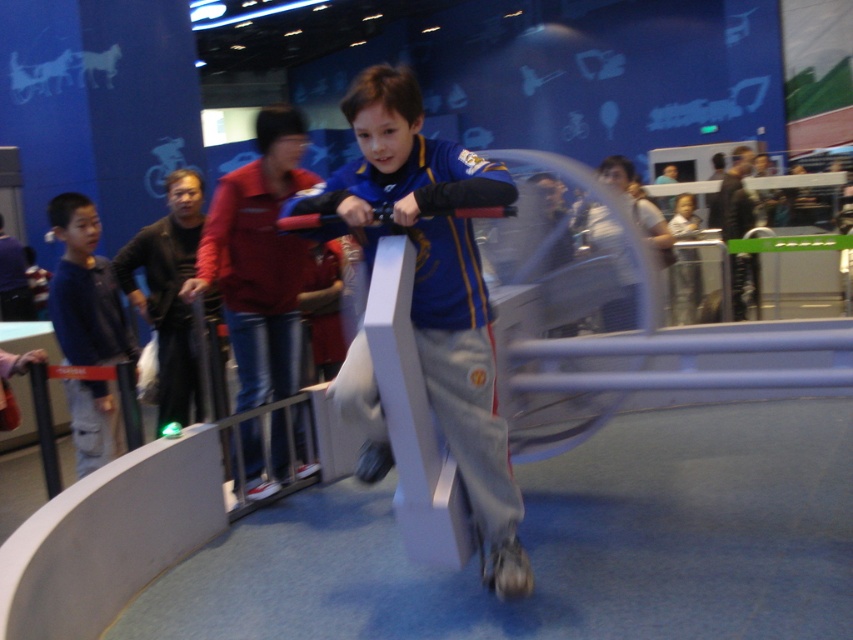
Question: Which of the following is the closest to the observer?

Choices:
 (A) (416, 257)
 (B) (102, 461)

Answer: (A)

Question: Is blue fabric jacket at center above blue denim jacket at left?

Choices:
 (A) no
 (B) yes

Answer: (A)

Question: Can you confirm if blue fabric jacket at center is positioned to the left of blue denim jacket at left?

Choices:
 (A) no
 (B) yes

Answer: (A)

Question: Which object appears farthest from the camera in this image?

Choices:
 (A) blue fabric jacket at center
 (B) blue denim jacket at left

Answer: (B)

Question: Does blue fabric jacket at center come in front of blue denim jacket at left?

Choices:
 (A) yes
 (B) no

Answer: (A)